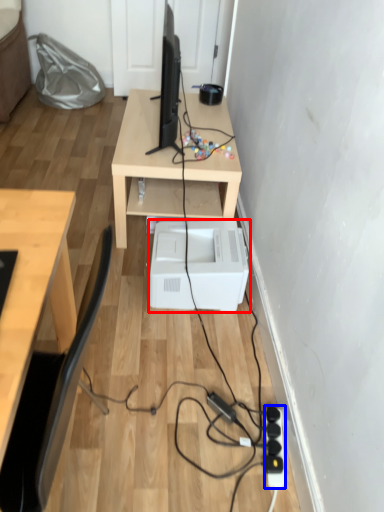
Question: Which point is closer to the camera, printer (highlighted by a red box) or extension cord (highlighted by a blue box)?

Choices:
 (A) printer
 (B) extension cord

Answer: (B)